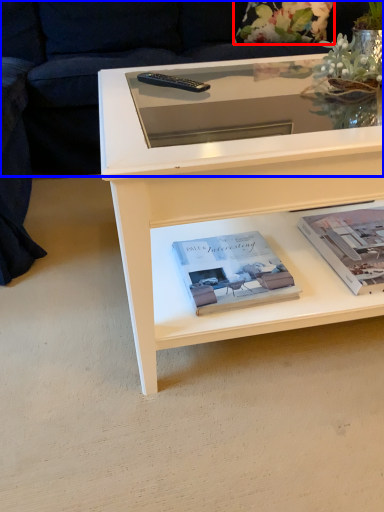
Question: Which object appears closest to the camera in this image, flower (highlighted by a red box) or couch (highlighted by a blue box)?

Choices:
 (A) flower
 (B) couch

Answer: (B)